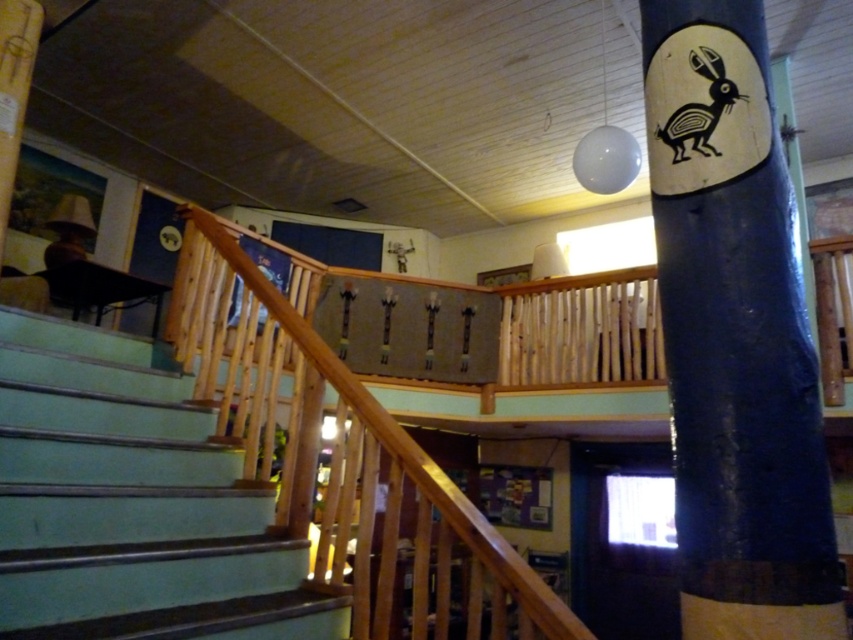
From the picture: Does blue painted wood pole at center have a larger size compared to wooden at upper center?

No, blue painted wood pole at center is not bigger than wooden at upper center.

Which is above, blue painted wood pole at center or wooden at upper center?

blue painted wood pole at center

Is point (728, 512) in front of point (200, 349)?

Yes, point (728, 512) is closer to viewer.

At what (x,y) coordinates should I click in order to perform the action: click on blue painted wood pole at center. Please return your answer as a coordinate pair (x, y). The image size is (853, 640). Looking at the image, I should click on (734, 333).

Is point (166, 467) farther from camera compared to point (502, 627)?

Yes, point (166, 467) is farther from viewer.

Between point (122, 532) and point (285, 353), which one is positioned in front?

Point (122, 532)

What do you see at coordinates (131, 502) in the screenshot? This screenshot has height=640, width=853. I see `teal painted wood stairs at lower left` at bounding box center [131, 502].

Locate an element on the screen. The width and height of the screenshot is (853, 640). teal painted wood stairs at lower left is located at coordinates (131, 502).

Between blue painted wood pole at center and teal painted wood stairs at lower left, which one appears on the right side from the viewer's perspective?

From the viewer's perspective, blue painted wood pole at center appears more on the right side.

Does blue painted wood pole at center lie behind teal painted wood stairs at lower left?

No, blue painted wood pole at center is in front of teal painted wood stairs at lower left.

Locate an element on the screen. This screenshot has width=853, height=640. blue painted wood pole at center is located at coordinates (734, 333).